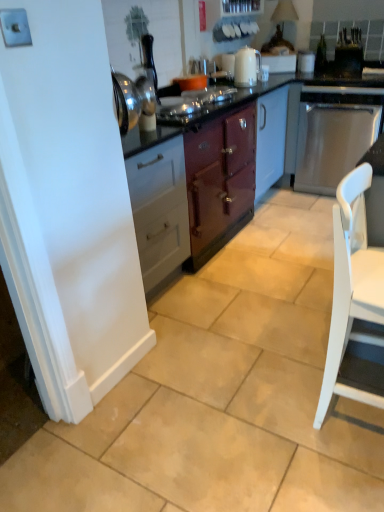
Find the location of a particular element. Image resolution: width=384 pixels, height=512 pixels. vacant space underneath white glossy electric kettle at upper center, which ranks as the 2th kitchen appliance in right-to-left order (from a real-world perspective) is located at coordinates (256, 85).